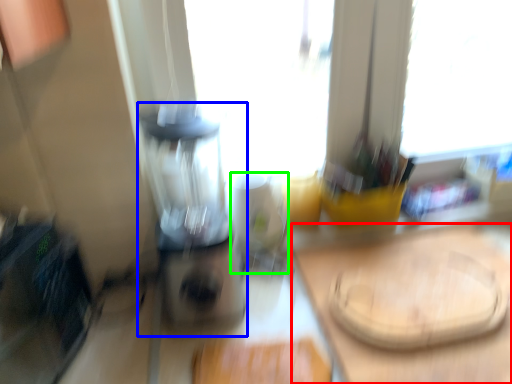
Question: Estimate the real-world distances between objects in this image. Which object is closer to counter top (highlighted by a red box), blender (highlighted by a blue box) or appliance (highlighted by a green box)?

Choices:
 (A) blender
 (B) appliance

Answer: (B)